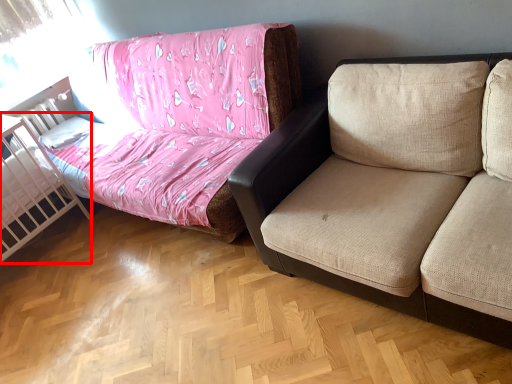
Question: Considering the relative positions of infant bed (annotated by the red box) and studio couch in the image provided, where is infant bed (annotated by the red box) located with respect to the staircase?

Choices:
 (A) left
 (B) right

Answer: (A)